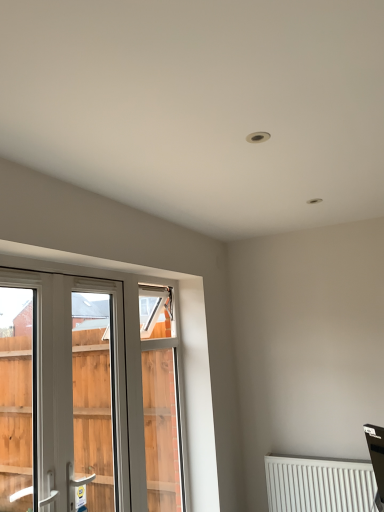
Question: Can you confirm if white matte radiator at lower right is taller than white plastic screen door at left?

Choices:
 (A) yes
 (B) no

Answer: (B)

Question: From the image's perspective, is white matte radiator at lower right located above white plastic screen door at left?

Choices:
 (A) no
 (B) yes

Answer: (A)

Question: Does white matte radiator at lower right have a larger size compared to white plastic screen door at left?

Choices:
 (A) no
 (B) yes

Answer: (A)

Question: Does white matte radiator at lower right have a lesser width compared to white plastic screen door at left?

Choices:
 (A) yes
 (B) no

Answer: (B)

Question: Is white matte radiator at lower right positioned with its back to white plastic screen door at left?

Choices:
 (A) yes
 (B) no

Answer: (B)

Question: From the image's perspective, is white matte radiator at lower right positioned above or below white plastic screen door at left?

Choices:
 (A) above
 (B) below

Answer: (B)

Question: Is white matte radiator at lower right to the left or to the right of white plastic screen door at left in the image?

Choices:
 (A) right
 (B) left

Answer: (A)

Question: Is point (286, 493) positioned closer to the camera than point (107, 303)?

Choices:
 (A) farther
 (B) closer

Answer: (B)

Question: Considering the positions of white matte radiator at lower right and white plastic screen door at left in the image, is white matte radiator at lower right bigger or smaller than white plastic screen door at left?

Choices:
 (A) big
 (B) small

Answer: (B)

Question: Looking at the image, does white plastic window at left seem bigger or smaller compared to white matte radiator at lower right?

Choices:
 (A) small
 (B) big

Answer: (A)

Question: Visually, is white plastic window at left positioned to the left or to the right of white matte radiator at lower right?

Choices:
 (A) left
 (B) right

Answer: (A)

Question: In the image, is white plastic window at left positioned in front of or behind white matte radiator at lower right?

Choices:
 (A) front
 (B) behind

Answer: (A)

Question: From a real-world perspective, is white plastic window at left above or below white matte radiator at lower right?

Choices:
 (A) below
 (B) above

Answer: (B)

Question: Considering the relative positions of white plastic window at left and white plastic screen door at left in the image provided, is white plastic window at left to the left or to the right of white plastic screen door at left?

Choices:
 (A) right
 (B) left

Answer: (B)

Question: Is white plastic window at left wider or thinner than white plastic screen door at left?

Choices:
 (A) wide
 (B) thin

Answer: (B)